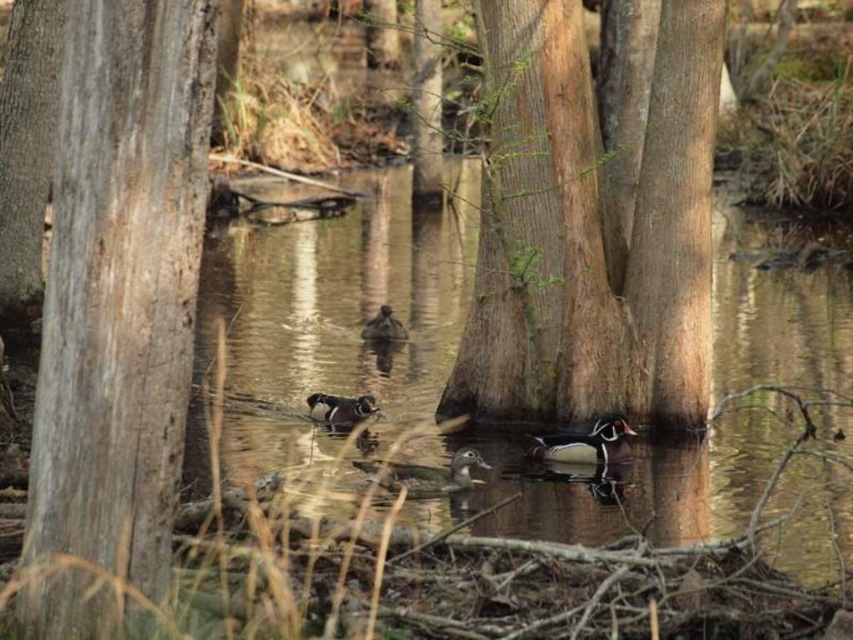
Is translucent water at center shorter than shiny brown duck at center?

No.

Is translucent water at center bigger than shiny brown duck at center?

Correct, translucent water at center is larger in size than shiny brown duck at center.

Describe the element at coordinates (345, 305) in the screenshot. This screenshot has width=853, height=640. I see `translucent water at center` at that location.

Find the location of a particular element. The height and width of the screenshot is (640, 853). translucent water at center is located at coordinates (345, 305).

Is smooth brown tree trunk at center positioned in front of shiny brown duck at center?

Yes.

Can you confirm if smooth brown tree trunk at center is positioned to the left of shiny brown duck at center?

No, smooth brown tree trunk at center is not to the left of shiny brown duck at center.

Between point (608, 221) and point (547, 440), which one is positioned in front?

Point (547, 440) is in front.

Where is `smooth brown tree trunk at center`? The image size is (853, 640). smooth brown tree trunk at center is located at coordinates (590, 230).

Is the position of gray textured log at left more distant than that of brown speckled duck at center?

No, gray textured log at left is closer to the viewer.

Who is lower down, gray textured log at left or brown speckled duck at center?

brown speckled duck at center

Which is behind, point (86, 497) or point (387, 339)?

The point (387, 339) is more distant.

This screenshot has width=853, height=640. I want to click on gray textured log at left, so click(x=117, y=316).